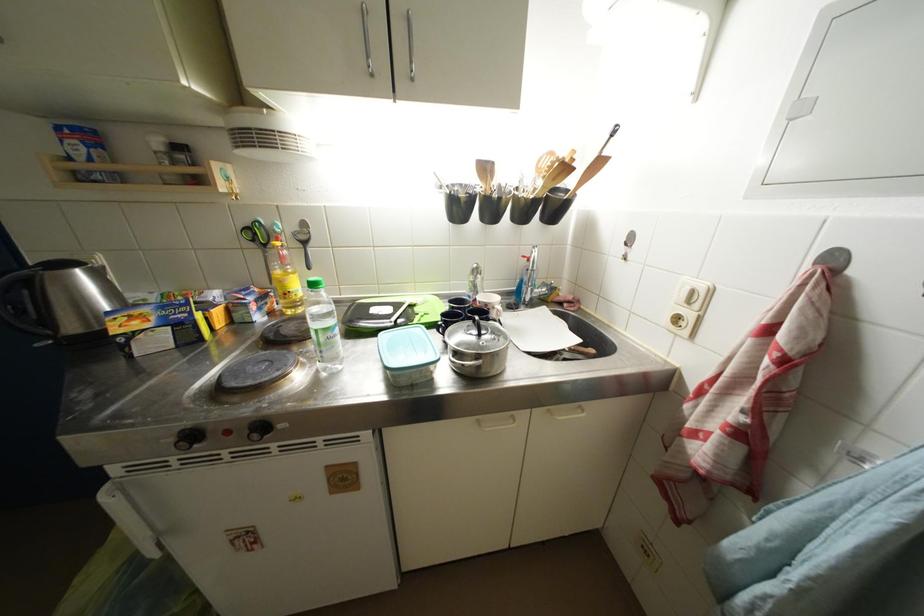
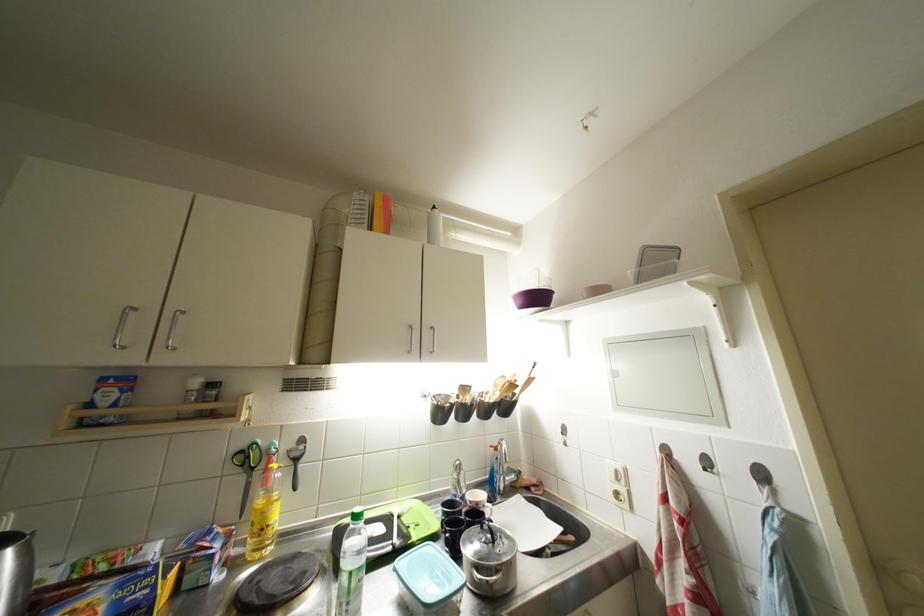
The point at (329, 344) is marked in the first image. Where is the corresponding point in the second image?

(359, 589)